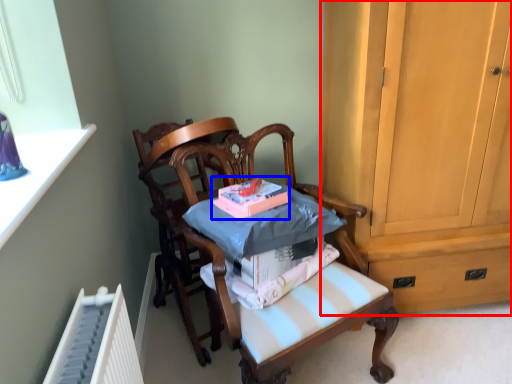
Question: Among these objects, which one is farthest to the camera, cabinetry (highlighted by a red box) or book (highlighted by a blue box)?

Choices:
 (A) cabinetry
 (B) book

Answer: (B)